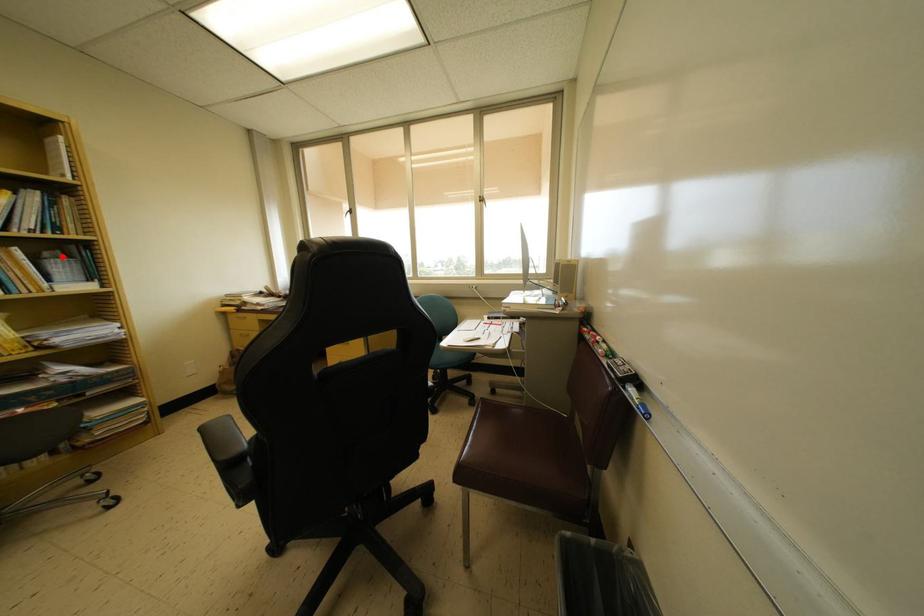
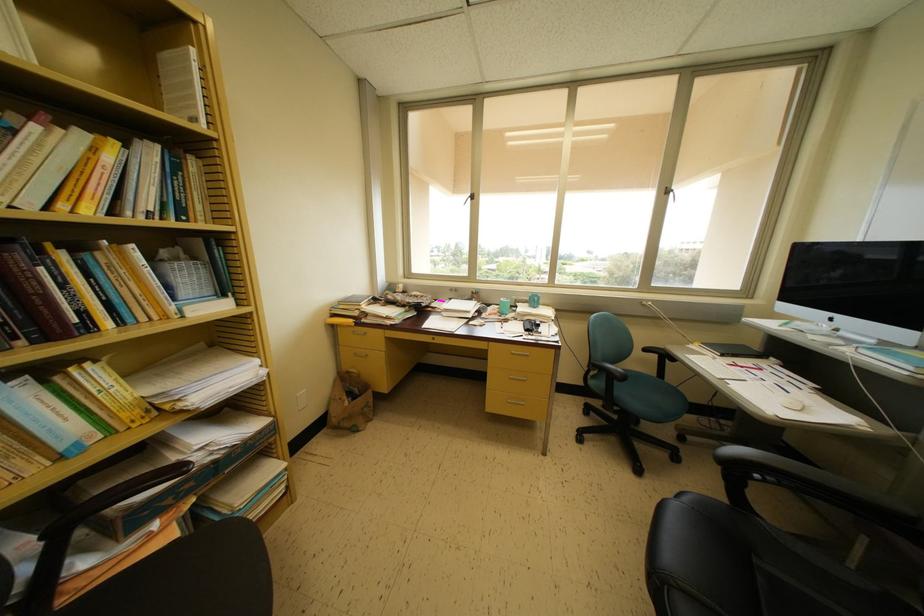
The point at the highlighted location is marked in the first image. Where is the corresponding point in the second image?

(181, 253)